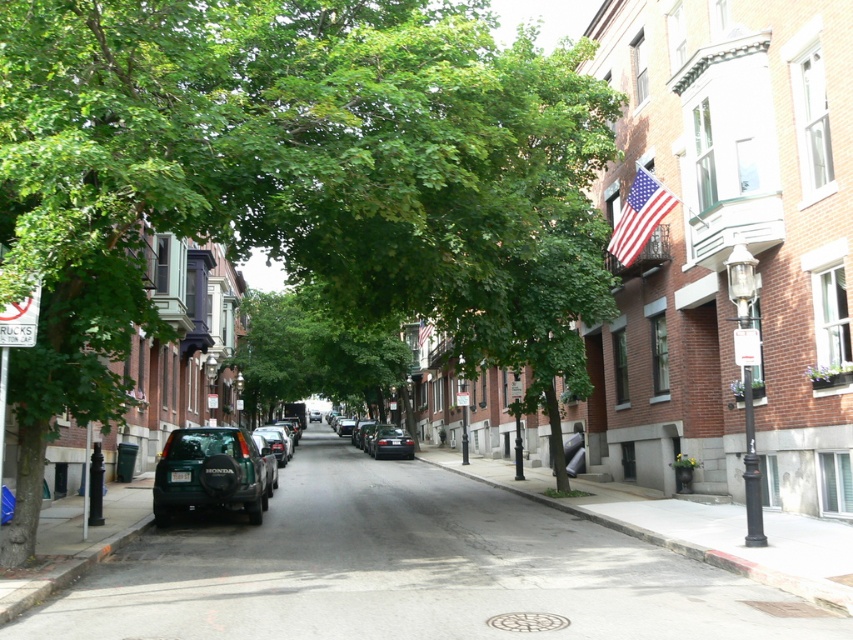
Is gray asphalt road at center thinner than american flag at upper right?

Incorrect, gray asphalt road at center's width is not less than american flag at upper right's.

Is gray asphalt road at center wider than american flag at upper right?

Correct, the width of gray asphalt road at center exceeds that of american flag at upper right.

This screenshot has height=640, width=853. I want to click on gray asphalt road at center, so pyautogui.click(x=408, y=570).

Where is `gray asphalt road at center`? The height and width of the screenshot is (640, 853). gray asphalt road at center is located at coordinates (408, 570).

Is point (416, 504) positioned before point (392, 449)?

Yes, it is in front of point (392, 449).

Image resolution: width=853 pixels, height=640 pixels. What are the coordinates of `gray asphalt road at center` in the screenshot? It's located at (408, 570).

Is point (238, 429) positioned before point (376, 452)?

Yes.

Is green matte suv at center further to the viewer compared to matte black car at center?

No.

Does point (190, 490) come closer to viewer compared to point (396, 442)?

Yes, point (190, 490) is in front of point (396, 442).

This screenshot has height=640, width=853. Find the location of `green matte suv at center`. green matte suv at center is located at coordinates (209, 474).